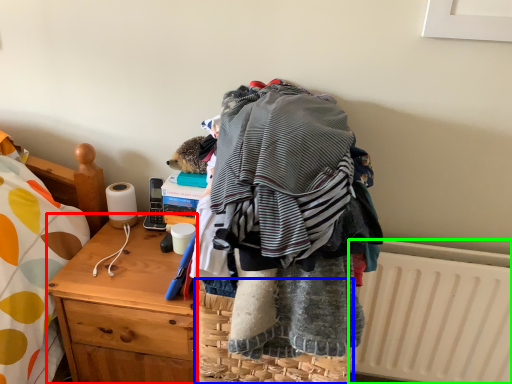
Question: Considering the real-world distances, which object is closest to desk (highlighted by a red box)? picnic basket (highlighted by a blue box) or radiator (highlighted by a green box).

Choices:
 (A) picnic basket
 (B) radiator

Answer: (A)